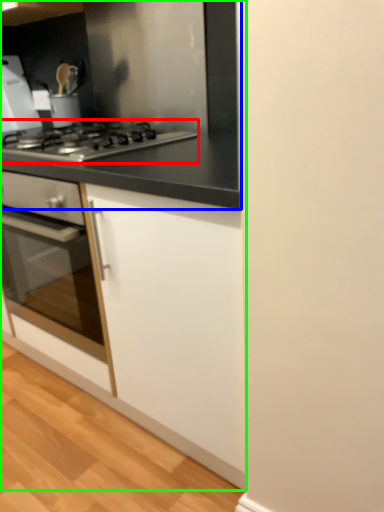
Question: Which is farther away from gas stove (highlighted by a red box)? countertop (highlighted by a blue box) or cabinetry (highlighted by a green box)?

Choices:
 (A) countertop
 (B) cabinetry

Answer: (B)